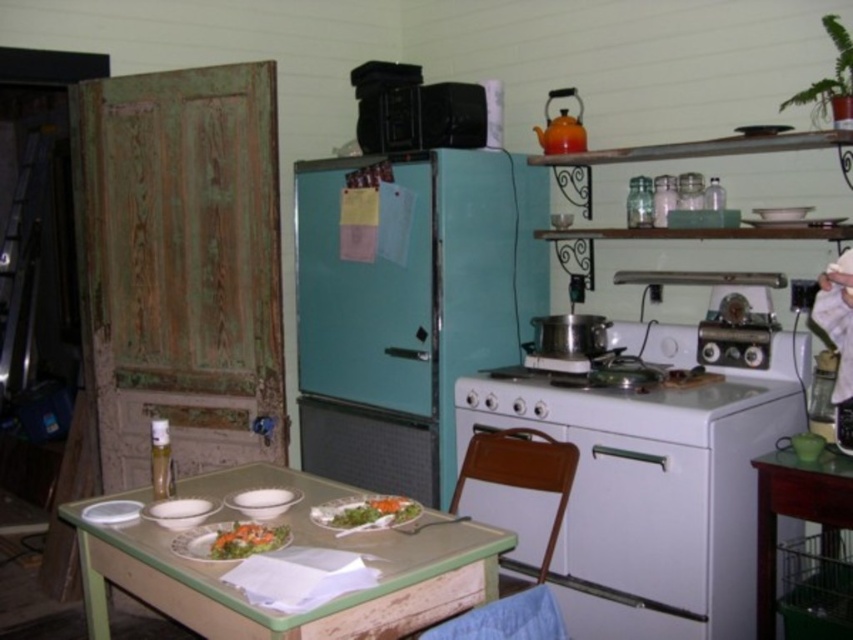
Is point (473, 259) behind point (764, 272)?

Yes, it is.

Looking at this image, who is more distant from viewer, (407,278) or (769,273)?

The point (407,278) is more distant.

Which is behind, point (344, 454) or point (749, 284)?

The point (344, 454) is more distant.

The height and width of the screenshot is (640, 853). In order to click on teal matte refrigerator at center in this screenshot , I will do `click(410, 312)`.

Is teal matte refrigerator at center closer to camera compared to wooden table at lower right?

No, it is not.

Does teal matte refrigerator at center come behind wooden table at lower right?

Yes.

You are a GUI agent. You are given a task and a screenshot of the screen. Output one action in this format:
    pyautogui.click(x=<x>, y=<y>)
    Task: Click on the teal matte refrigerator at center
    
    Given the screenshot: What is the action you would take?
    pyautogui.click(x=410, y=312)

Describe the element at coordinates (410, 312) in the screenshot. I see `teal matte refrigerator at center` at that location.

Is point (503, 172) behind point (248, 554)?

That is True.

Who is more distant from viewer, (302, 240) or (245, 522)?

The point (302, 240) is behind.

At what (x,y) coordinates should I click in order to perform the action: click on teal matte refrigerator at center. Please return your answer as a coordinate pair (x, y). This screenshot has width=853, height=640. Looking at the image, I should click on (410, 312).